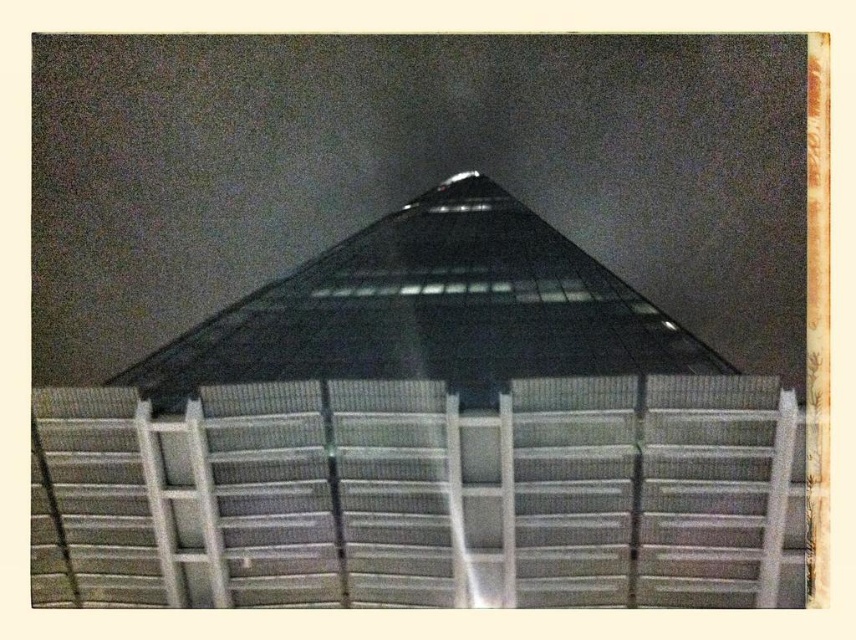
Question: Does metallic grid at center have a smaller size compared to transparent glass roof at center?

Choices:
 (A) no
 (B) yes

Answer: (B)

Question: Is metallic grid at center smaller than transparent glass roof at center?

Choices:
 (A) yes
 (B) no

Answer: (A)

Question: Among these points, which one is nearest to the camera?

Choices:
 (A) (354, 467)
 (B) (497, 284)

Answer: (A)

Question: Is metallic grid at center smaller than transparent glass roof at center?

Choices:
 (A) no
 (B) yes

Answer: (B)